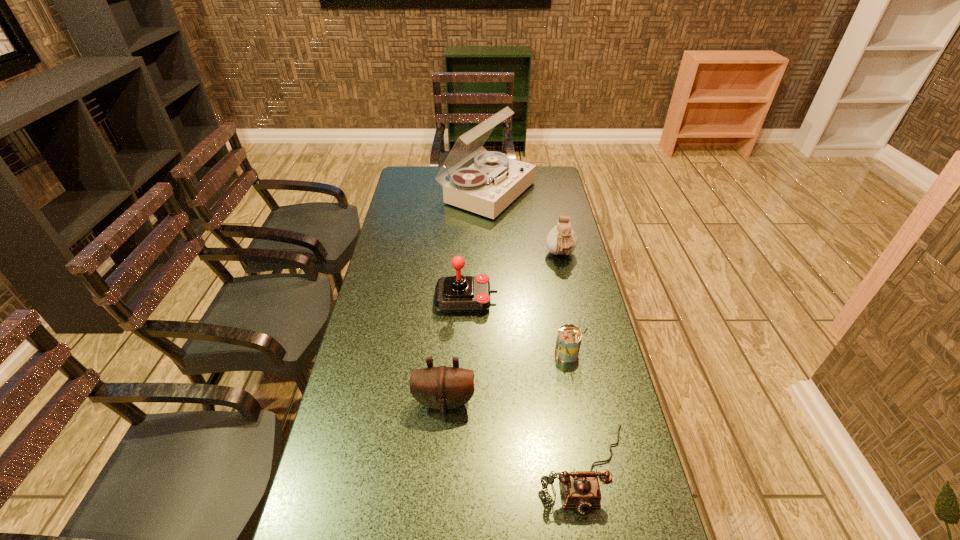
The width and height of the screenshot is (960, 540). What are the coordinates of `record player` in the screenshot? It's located at (488, 186).

The height and width of the screenshot is (540, 960). Identify the location of the tallest object. (488, 186).

The image size is (960, 540). What are the coordinates of `the fourth nearest object` in the screenshot? It's located at (454, 294).

At what (x,y) coordinates should I click in order to perform the action: click on the right pouch. Please return your answer as a coordinate pair (x, y). This screenshot has height=540, width=960. Looking at the image, I should click on (561, 240).

Locate an element on the screen. Image resolution: width=960 pixels, height=540 pixels. the farther pouch is located at coordinates click(x=561, y=240).

The height and width of the screenshot is (540, 960). Identify the location of the nearer pouch. (443, 388).

At what (x,y) coordinates should I click in order to perform the action: click on the left pouch. Please return your answer as a coordinate pair (x, y). Looking at the image, I should click on (443, 388).

Locate an element on the screen. This screenshot has height=540, width=960. the third nearest object is located at coordinates (569, 337).

Image resolution: width=960 pixels, height=540 pixels. What are the coordinates of `the nearest object` in the screenshot? It's located at (580, 489).

The image size is (960, 540). In order to click on the shortest object in this screenshot , I will do `click(580, 489)`.